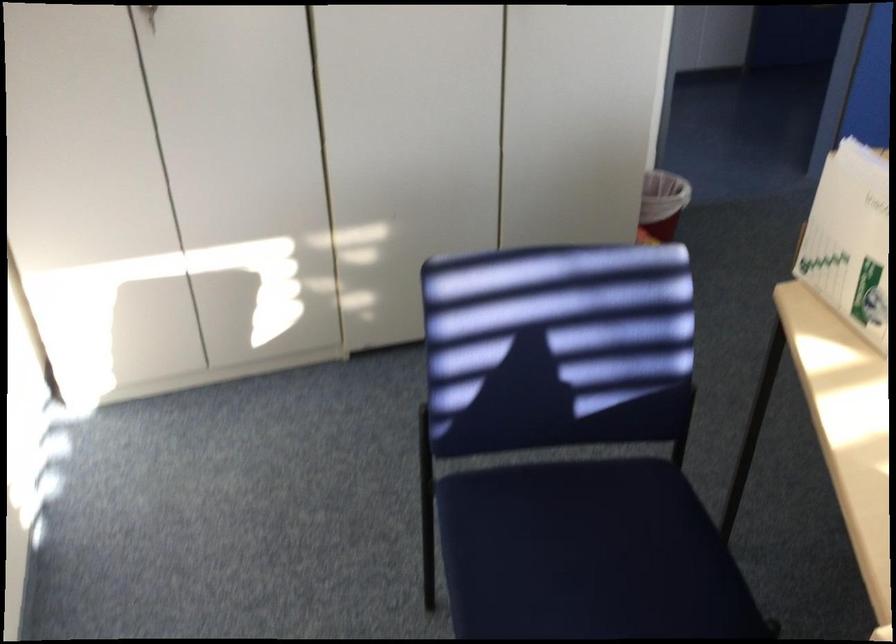
Find where to lift the red trash can. Please return your answer as a coordinate pair (x, y).

(661, 203)